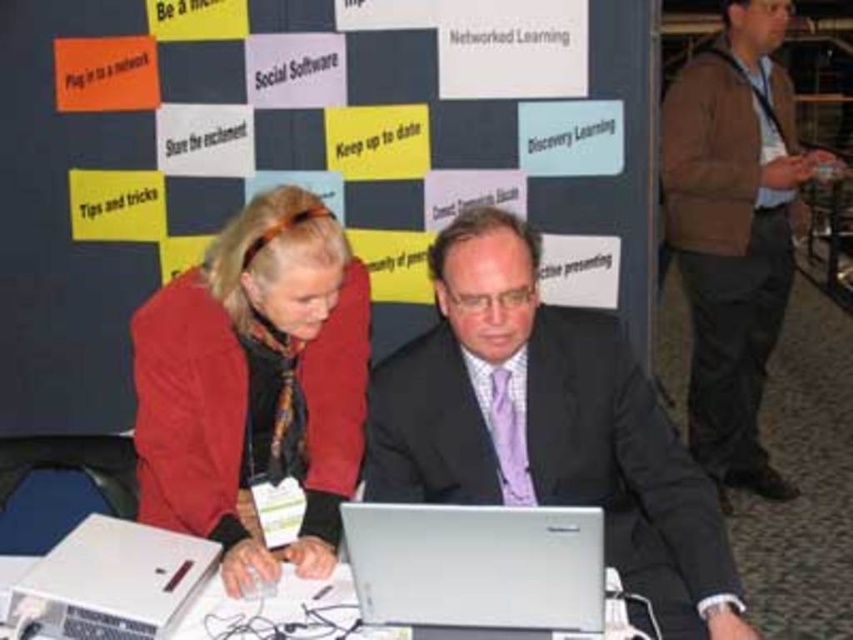
You are a photographer at the event and need to capture a photo of both the matte black suit at center and the matte red jacket at center. Based on their heights, which one should you focus on first to ensure both are in frame?

The matte black suit at center is taller than the matte red jacket at center, so you should focus on the matte black suit at center first to ensure both are in frame.